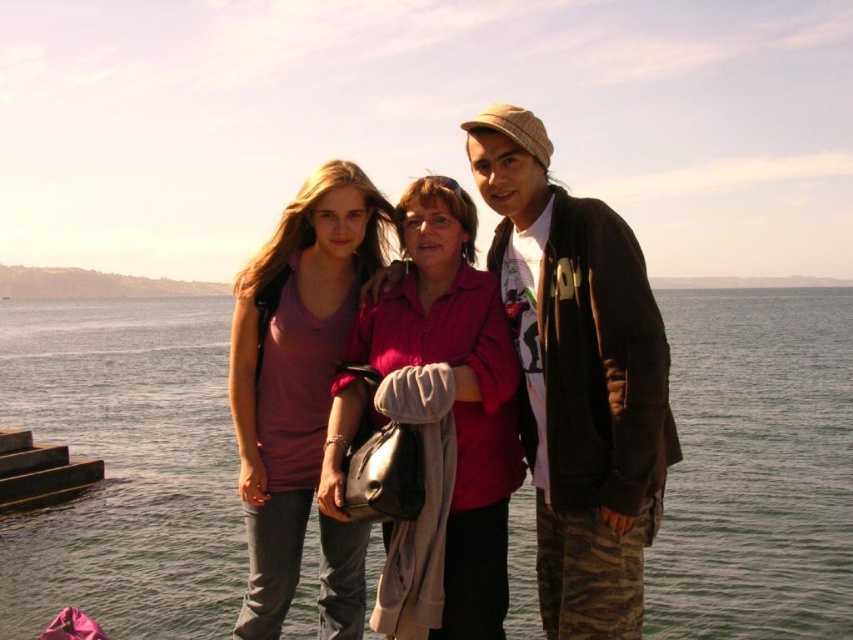
In the scene, there are two people wearing pink matte shirt at center and matte purple shirt at center. From the perspective of someone facing the group, which shirt is positioned to the right?

The pink matte shirt at center is to the right of the matte purple shirt at center.

Consider the image. You are a photographer trying to capture a group photo of the camouflage pants at right and the matte purple shirt at center. Since you want to ensure both subjects are in focus, which one should you focus on first considering their positions?

You should focus on the camouflage pants at right first because it is closer to the viewer than the matte purple shirt at center, so adjusting focus from near to far will help both be in focus.

You are a photographer trying to capture a group photo of the pink matte shirt at center and the matte purple shirt at center. Based on their positions, which one should you focus on first to ensure they are both in frame?

The pink matte shirt at center should be focused on first because it is located above the matte purple shirt at center, so adjusting the camera angle to include the higher positioned subject ensures both are in frame.